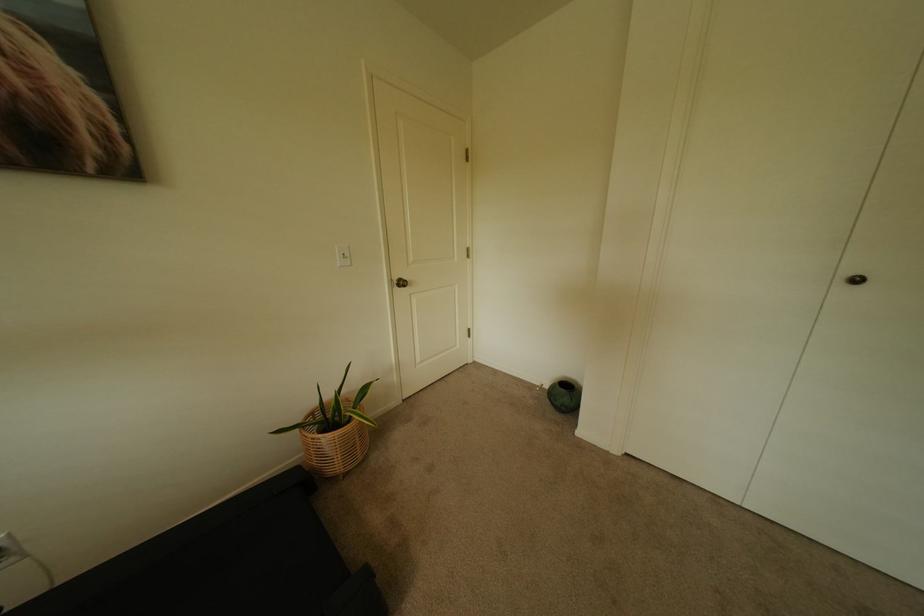
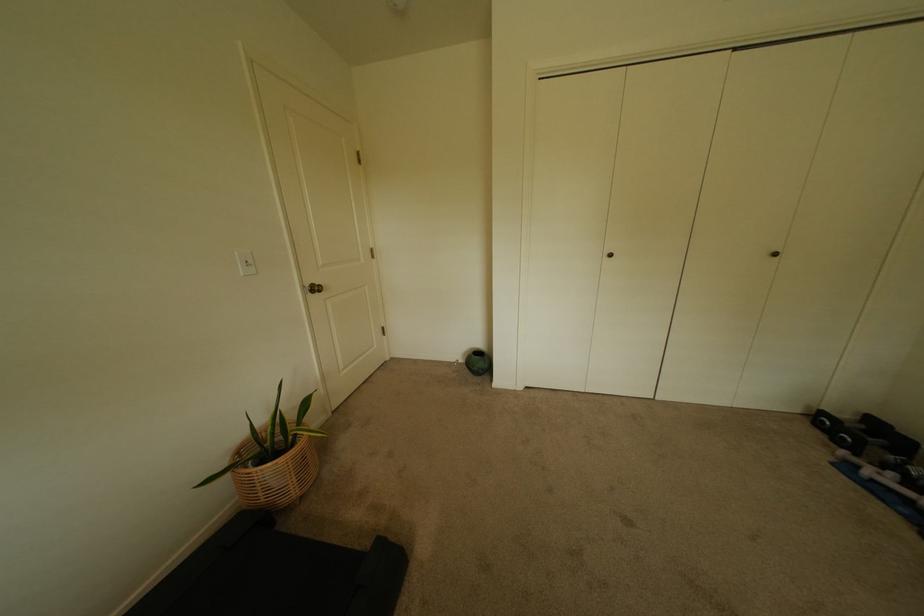
In the second image, find the point that corresponds to (403,280) in the first image.

(315, 286)